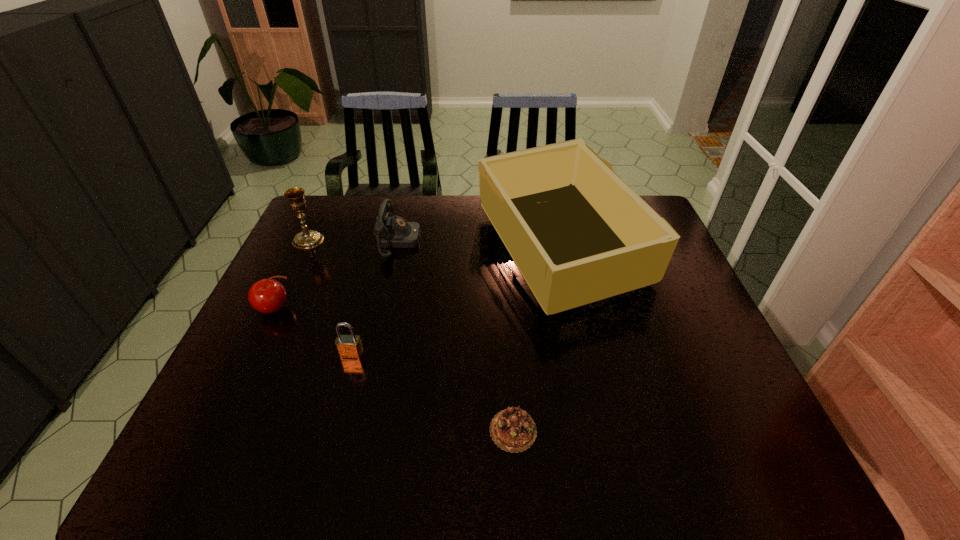
The height and width of the screenshot is (540, 960). In order to click on vacant area that lies between the telephone and the tallest object in this screenshot , I will do `click(479, 245)`.

In order to click on free space between the fifth shortest object and the fifth farthest object in this screenshot , I will do `click(330, 297)`.

Find the location of a particular element. This screenshot has width=960, height=540. unoccupied area between the tallest object and the cherry is located at coordinates (419, 279).

Locate an element on the screen. The image size is (960, 540). empty space that is in between the cherry and the chalice is located at coordinates (293, 274).

Image resolution: width=960 pixels, height=540 pixels. Identify the location of free space between the cherry and the chalice. (293, 274).

The height and width of the screenshot is (540, 960). What are the coordinates of `unoccupied position between the tallest object and the padlock` in the screenshot? It's located at (456, 301).

At what (x,y) coordinates should I click in order to perform the action: click on empty location between the nearest object and the box. Please return your answer as a coordinate pair (x, y). Looking at the image, I should click on (537, 339).

The image size is (960, 540). Find the location of `free space that is in between the padlock and the tallest object`. free space that is in between the padlock and the tallest object is located at coordinates (456, 301).

Point out which object is positioned as the fourth nearest to the tallest object. Please provide its 2D coordinates. Your answer should be formatted as a tuple, i.e. [(x, y)], where the tuple contains the x and y coordinates of a point satisfying the conditions above.

[(268, 296)]

Locate an element on the screen. This screenshot has height=540, width=960. object that is the third closest to the fifth shortest object is located at coordinates tap(348, 346).